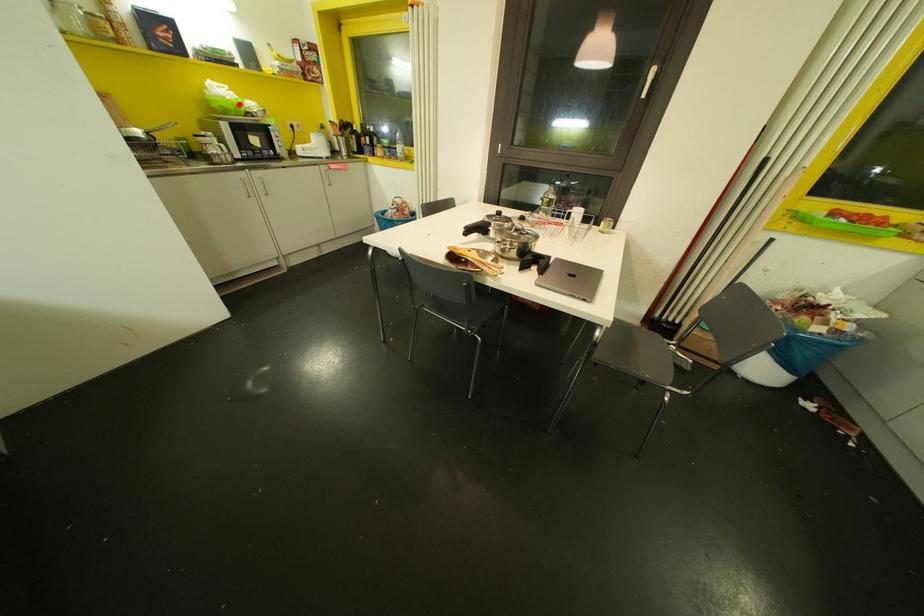
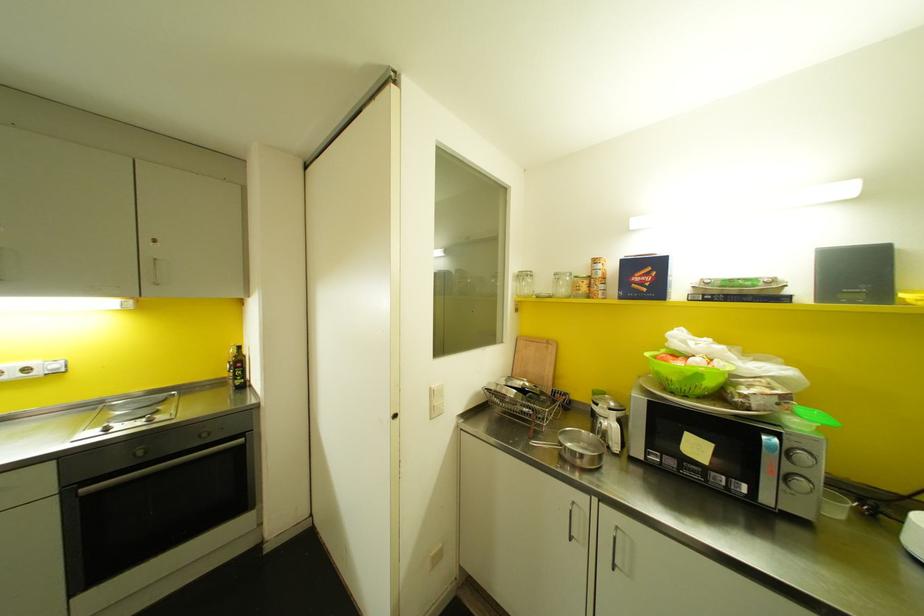
In the second image, find the point that corresponds to the highlighted location in the first image.

(698, 376)